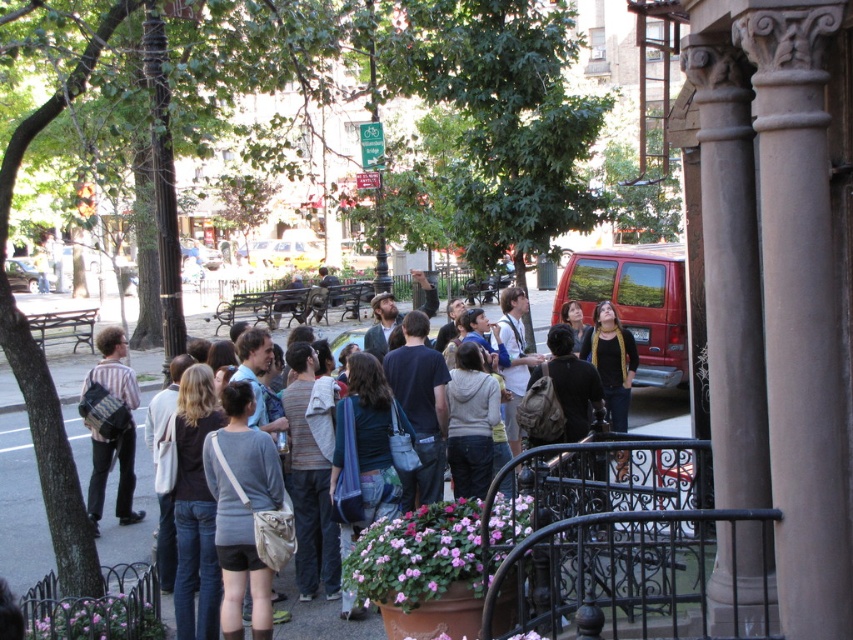
Is matte gray backpack at center behind striped cotton shirt at center?

That is False.

The height and width of the screenshot is (640, 853). I want to click on matte gray backpack at center, so click(136, 502).

Between point (112, 483) and point (132, 394), which one is positioned in front?

Point (132, 394) is in front.

You are a GUI agent. You are given a task and a screenshot of the screen. Output one action in this format:
    pyautogui.click(x=<x>, y=<y>)
    Task: Click on the matte gray backpack at center
    This screenshot has width=853, height=640.
    Given the screenshot: What is the action you would take?
    pyautogui.click(x=136, y=502)

What do you see at coordinates (729, 273) in the screenshot? The width and height of the screenshot is (853, 640). I see `smooth stone column at right` at bounding box center [729, 273].

Between point (706, 51) and point (321, 612), which one is positioned in front?

Positioned in front is point (706, 51).

Does point (759, 557) come behind point (142, 413)?

No.

This screenshot has width=853, height=640. In order to click on smooth stone column at right in this screenshot , I will do `click(729, 273)`.

Who is more distant from viewer, (746, 456) or (100, 353)?

The point (100, 353) is more distant.

Does point (738, 304) lie behind point (109, 460)?

No.

Does point (717, 211) lie in front of point (122, 381)?

Yes.

Where is `smooth stone column at right`? This screenshot has width=853, height=640. smooth stone column at right is located at coordinates (729, 273).